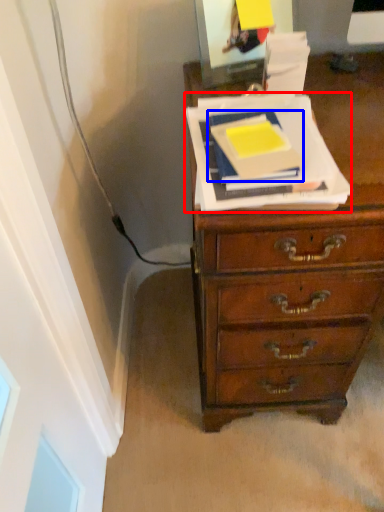
Question: Which object is closer to the camera taking this photo, paperback book (highlighted by a red box) or paperback book (highlighted by a blue box)?

Choices:
 (A) paperback book
 (B) paperback book

Answer: (A)